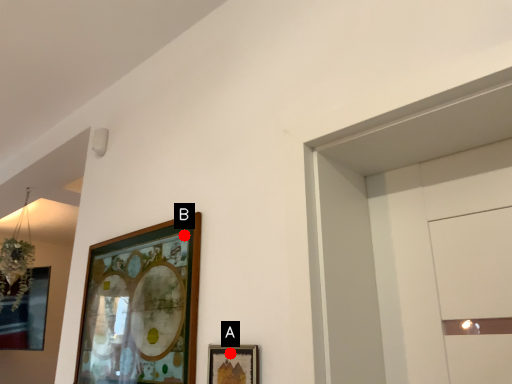
Question: Two points are circled on the image, labeled by A and B beside each circle. Which point is closer to the camera?

Choices:
 (A) A is closer
 (B) B is closer

Answer: (A)